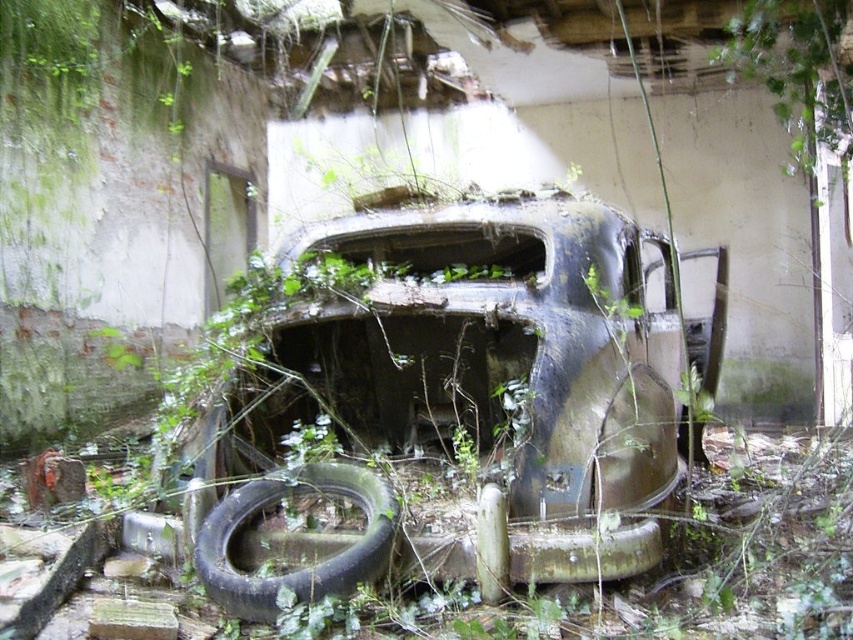
You are a mechanic trying to assess the condition of the rusty metal car at center and the black rubber tire at lower left. Which object takes up more space in the image?

The rusty metal car at center is bigger than the black rubber tire at lower left, so it takes up more space in the image.

You are a maintenance worker assessing the abandoned site. You need to determine if the rusty metal car at center can be lifted out using a crane that requires at least 2 meters of clearance above the car. Given the height of the green leafy vines at upper center, is there enough space for the crane to operate safely?

The rusty metal car at center is taller than the green leafy vines at upper center. Since the crane requires at least 2 meters of clearance above the car, but the vines are shorter than the car, the crane would need to ensure that its boom can reach over the car while maintaining the required clearance. However, without knowing the exact height of the car or the vines, it is impossible to determine if there is sufficient space. Additional measurements are needed.

You are standing at the entrance of the dilapidated building and see the abandoned vehicle. There is a black rubber tire at lower left marked by point (302, 566). If you walk straight towards the vehicle, will you step on the black rubber tire at lower left before reaching the car?

The black rubber tire at lower left marked by point (302, 566) is located at the lower left position relative to the vehicle. Since you are walking straight towards the car from the entrance, you would reach the car before encountering the tire which is positioned to the side, so no, you will not step on the black rubber tire at lower left before reaching the car.